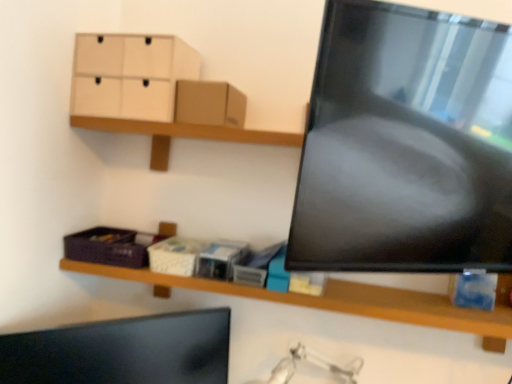
Question: Is white cardboard tissue box at center, which is counted as the second storage box, starting from the left, taller than matte black monitor at lower left?

Choices:
 (A) no
 (B) yes

Answer: (A)

Question: Considering the relative positions of white cardboard tissue box at center, which is counted as the second storage box, starting from the left, and matte black monitor at lower left in the image provided, is white cardboard tissue box at center, which is counted as the second storage box, starting from the left, to the right of matte black monitor at lower left from the viewer's perspective?

Choices:
 (A) yes
 (B) no

Answer: (A)

Question: From the image's perspective, is white cardboard tissue box at center, which is counted as the second storage box, starting from the left, beneath matte black monitor at lower left?

Choices:
 (A) no
 (B) yes

Answer: (A)

Question: Considering the relative sizes of white cardboard tissue box at center, which is the second storage box from right to left, and matte black monitor at lower left in the image provided, is white cardboard tissue box at center, which is the second storage box from right to left, wider than matte black monitor at lower left?

Choices:
 (A) no
 (B) yes

Answer: (B)

Question: Does white cardboard tissue box at center, which is counted as the second storage box, starting from the left, appear on the left side of matte black monitor at lower left?

Choices:
 (A) no
 (B) yes

Answer: (A)

Question: Is white cardboard tissue box at center, which is counted as the second storage box, starting from the left, turned away from matte black monitor at lower left?

Choices:
 (A) yes
 (B) no

Answer: (B)

Question: Is wooden shelf at lower center located within brown cardboard box at upper center?

Choices:
 (A) no
 (B) yes

Answer: (A)

Question: Considering the relative sizes of brown cardboard box at upper center and wooden shelf at lower center in the image provided, is brown cardboard box at upper center thinner than wooden shelf at lower center?

Choices:
 (A) no
 (B) yes

Answer: (B)

Question: From a real-world perspective, is brown cardboard box at upper center physically above wooden shelf at lower center?

Choices:
 (A) no
 (B) yes

Answer: (B)

Question: Does brown cardboard box at upper center have a smaller size compared to wooden shelf at lower center?

Choices:
 (A) yes
 (B) no

Answer: (A)

Question: Can we say brown cardboard box at upper center lies outside wooden shelf at lower center?

Choices:
 (A) no
 (B) yes

Answer: (B)

Question: Is brown cardboard box at upper center positioned far away from wooden shelf at lower center?

Choices:
 (A) no
 (B) yes

Answer: (A)

Question: Does wooden shelf at lower center have a lesser height compared to matte black monitor at lower left?

Choices:
 (A) yes
 (B) no

Answer: (A)